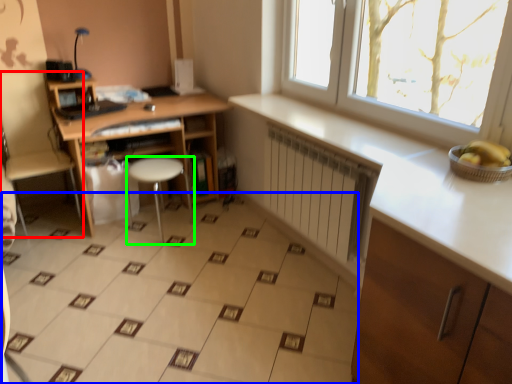
Question: Estimate the real-world distances between objects in this image. Which object is closer to swivel chair (highlighted by a red box), ceramic tile (highlighted by a blue box) or stool (highlighted by a green box)?

Choices:
 (A) ceramic tile
 (B) stool

Answer: (B)